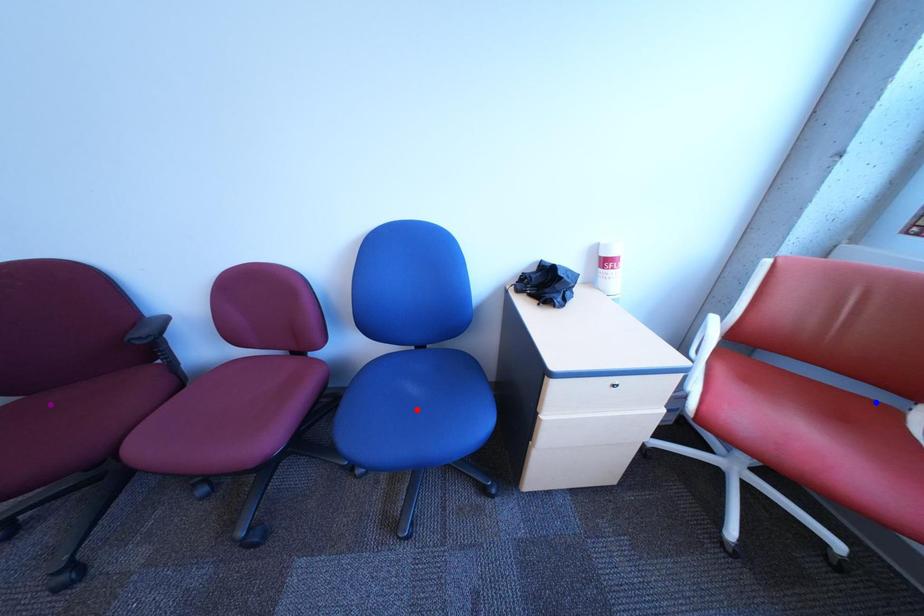
Order these from nearest to farthest:
- purple point
- blue point
- red point

blue point → purple point → red point